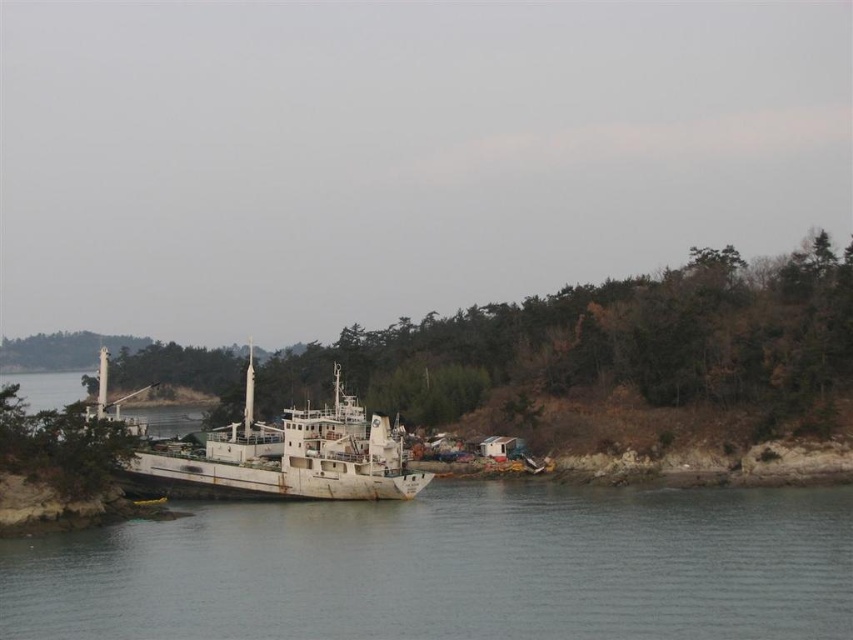
You are a marine biologist observing the coastal scene. You need to determine the relative height of the rusty metallic water at lower center and the rusty metal boat at center. Which one has a greater height?

The rusty metal boat at center has a greater height than the rusty metallic water at lower center, as the water is described as not as tall as the boat.

You are a photographer planning to capture the rusty metallic water at lower center and the rusty metal boat at center in a single frame. Given their widths, which object will occupy more of the horizontal space in your photo?

The rusty metal boat at center will occupy more horizontal space in the photo since it has a greater width than the rusty metallic water at lower center.